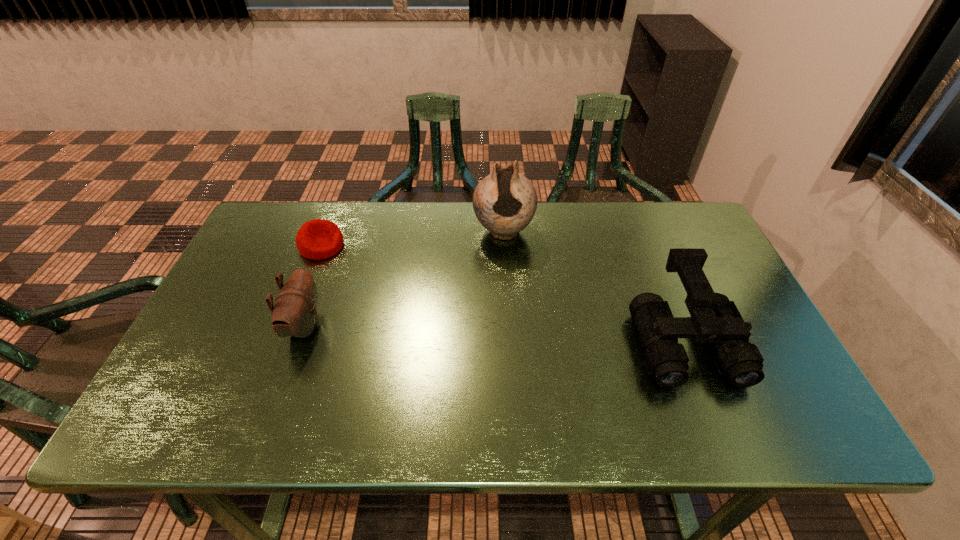
Identify the location of free space located on the seat area of the beanbag. The height and width of the screenshot is (540, 960). (387, 282).

You are a GUI agent. You are given a task and a screenshot of the screen. Output one action in this format:
    pyautogui.click(x=<x>, y=<y>)
    Task: Click on the free spot located on the seat area of the beanbag
    Image resolution: width=960 pixels, height=540 pixels.
    Given the screenshot: What is the action you would take?
    pyautogui.click(x=398, y=287)

The image size is (960, 540). What are the coordinates of `free spot located 0.150m on the seat area of the beanbag` in the screenshot? It's located at (374, 274).

I want to click on pottery positioned at the far edge, so click(505, 201).

The width and height of the screenshot is (960, 540). What are the coordinates of `beanbag situated at the far edge` in the screenshot? It's located at (317, 239).

Identify the location of object positioned at the near edge. (714, 318).

This screenshot has width=960, height=540. Find the location of `object that is at the left edge`. object that is at the left edge is located at coordinates (317, 239).

What are the coordinates of `object located in the right edge section of the desktop` in the screenshot? It's located at (714, 318).

Identify the location of object that is at the far left corner. This screenshot has width=960, height=540. (317, 239).

I want to click on object present at the near right corner, so click(x=714, y=318).